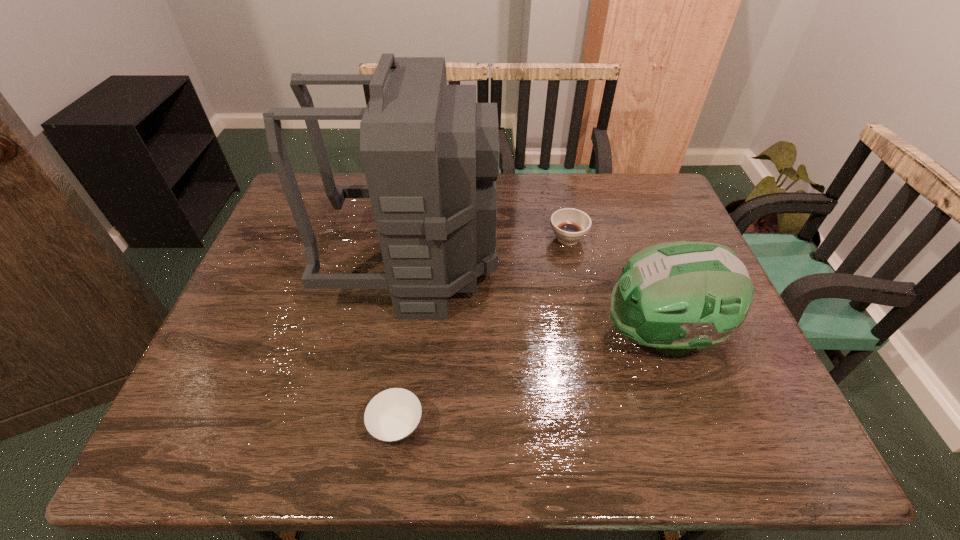
Identify the location of free space between the football helmet and the nearer soup bowl. The width and height of the screenshot is (960, 540). (528, 382).

This screenshot has width=960, height=540. I want to click on free area in between the football helmet and the right soup bowl, so click(613, 287).

You are a GUI agent. You are given a task and a screenshot of the screen. Output one action in this format:
    pyautogui.click(x=<x>, y=<y>)
    Task: Click on the empty space between the football helmet and the farther soup bowl
    The image size is (960, 540).
    Given the screenshot: What is the action you would take?
    pyautogui.click(x=613, y=287)

This screenshot has width=960, height=540. What are the coordinates of `vacant region between the right soup bowl and the football helmet` in the screenshot? It's located at (613, 287).

Where is `free area in between the second tallest object and the left soup bowl`? This screenshot has height=540, width=960. free area in between the second tallest object and the left soup bowl is located at coordinates (528, 382).

This screenshot has height=540, width=960. Find the location of `free space between the right soup bowl and the left soup bowl`. free space between the right soup bowl and the left soup bowl is located at coordinates (483, 333).

What are the coordinates of `free spot between the right soup bowl and the nearest object` in the screenshot? It's located at (483, 333).

Where is `vacant area that lies between the right soup bowl and the second tallest object`? vacant area that lies between the right soup bowl and the second tallest object is located at coordinates (613, 287).

Choose which object is the second nearest neighbor to the nearest object. Please provide its 2D coordinates. Your answer should be formatted as a tuple, i.e. [(x, y)], where the tuple contains the x and y coordinates of a point satisfying the conditions above.

[(677, 296)]

Locate which object is the third closest to the tallest object. Please provide its 2D coordinates. Your answer should be formatted as a tuple, i.e. [(x, y)], where the tuple contains the x and y coordinates of a point satisfying the conditions above.

[(677, 296)]